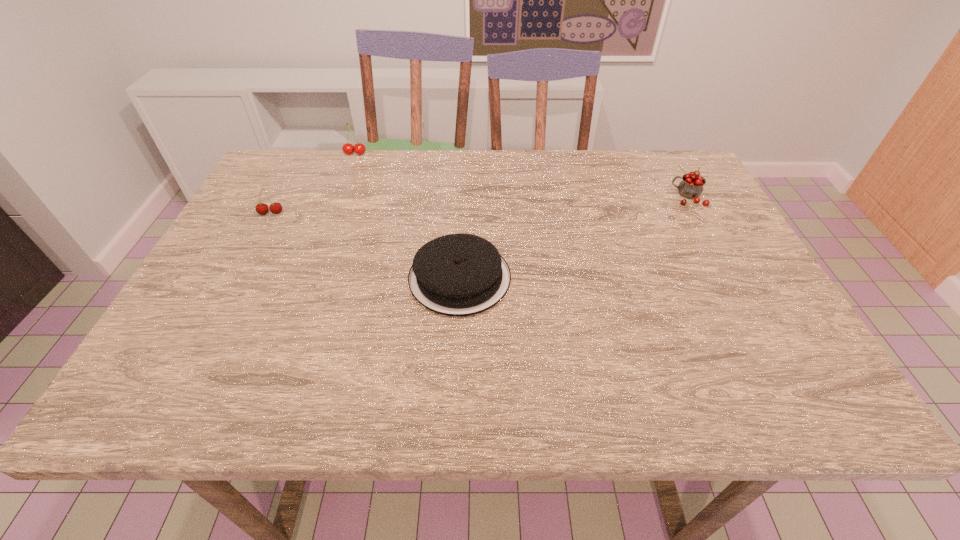
Locate an element on the screen. The image size is (960, 540). the second cherry from left to right is located at coordinates (359, 148).

At what (x,y) coordinates should I click in order to perform the action: click on the farthest cherry. Please return your answer as a coordinate pair (x, y). Looking at the image, I should click on click(359, 148).

Identify the location of the second nearest cherry. This screenshot has width=960, height=540. click(691, 186).

Where is `the rightmost object`? the rightmost object is located at coordinates (691, 186).

At what (x,y) coordinates should I click in order to perform the action: click on the leftmost object. Please return your answer as a coordinate pair (x, y). Looking at the image, I should click on (275, 208).

Locate an element on the screen. the leftmost cherry is located at coordinates (275, 208).

The height and width of the screenshot is (540, 960). Find the location of `the third object from left to right`. the third object from left to right is located at coordinates (458, 275).

The width and height of the screenshot is (960, 540). I want to click on the nearest object, so pyautogui.click(x=458, y=275).

Locate an element on the screen. This screenshot has height=540, width=960. vacant position located with the stems of the farthest object pointing upwards is located at coordinates (322, 244).

Where is `vacant position located 0.390m on the handle side of the second nearest cherry`? vacant position located 0.390m on the handle side of the second nearest cherry is located at coordinates (523, 197).